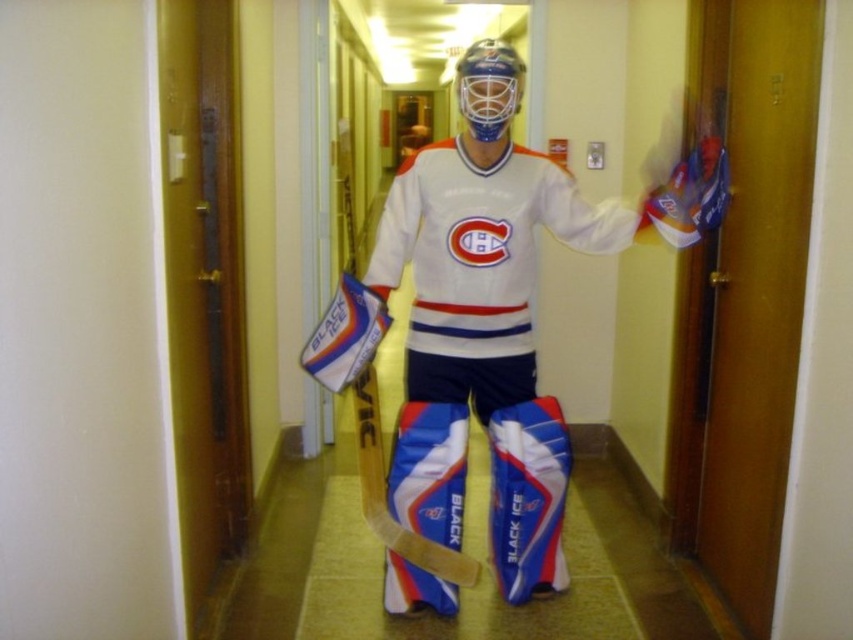
Question: Can you confirm if white matte jersey at center is wider than blue and white composite hockey stick at center?

Choices:
 (A) yes
 (B) no

Answer: (A)

Question: Among these objects, which one is farthest from the camera?

Choices:
 (A) white matte jersey at center
 (B) blue and white composite hockey stick at center

Answer: (B)

Question: Does white matte jersey at center have a greater width compared to blue and white composite hockey stick at center?

Choices:
 (A) no
 (B) yes

Answer: (B)

Question: Is the position of white matte jersey at center less distant than that of blue and white composite hockey stick at center?

Choices:
 (A) yes
 (B) no

Answer: (A)

Question: Which point appears closest to the camera in this image?

Choices:
 (A) (465, 298)
 (B) (355, 387)

Answer: (B)